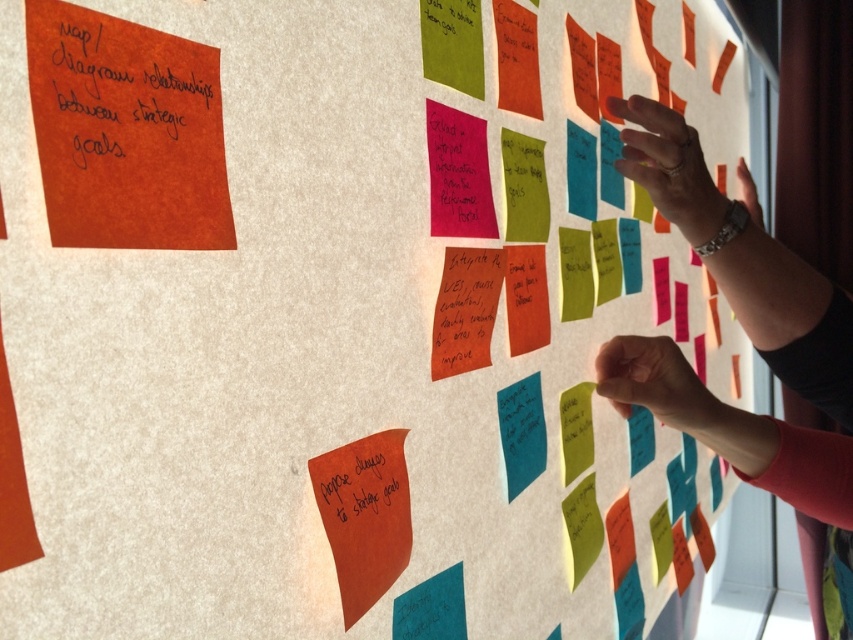
Is point (68, 108) closer to viewer compared to point (199, 189)?

Yes, it is in front of point (199, 189).

Can you confirm if orange matte sticky note at upper left is taller than orange matte paper at upper left?

Incorrect, orange matte sticky note at upper left's height is not larger of orange matte paper at upper left's.

Image resolution: width=853 pixels, height=640 pixels. What do you see at coordinates (126, 132) in the screenshot? I see `orange matte sticky note at upper left` at bounding box center [126, 132].

Where is `orange matte sticky note at upper left`? orange matte sticky note at upper left is located at coordinates (126, 132).

Is point (666, 403) closer to camera compared to point (372, 541)?

No, it is not.

Which is behind, point (846, 342) or point (363, 508)?

The point (846, 342) is behind.

The width and height of the screenshot is (853, 640). Identify the location of metallic wristwatch at upper right. click(746, 259).

At what (x,y) coordinates should I click in order to perform the action: click on metallic wristwatch at upper right. Please return your answer as a coordinate pair (x, y). This screenshot has height=640, width=853. Looking at the image, I should click on (746, 259).

How far apart are orange matte paper at upper left and matte orange sticky note at bottom left?

The distance of orange matte paper at upper left from matte orange sticky note at bottom left is 8.99 inches.

Can you confirm if orange matte paper at upper left is positioned below matte orange sticky note at bottom left?

No.

Identify the location of orange matte paper at upper left. This screenshot has height=640, width=853. (125, 125).